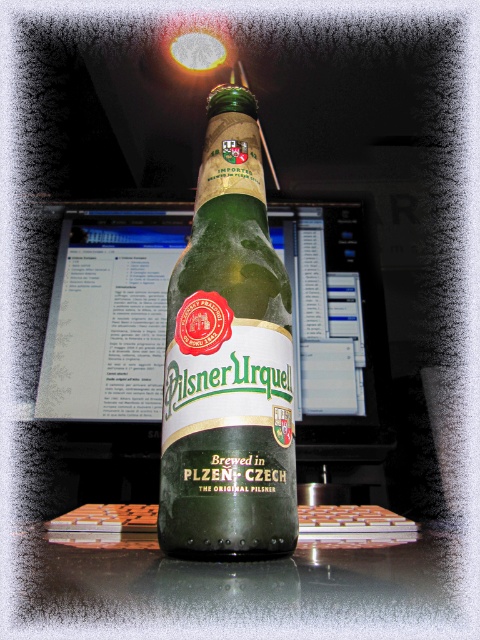
Question: Is green glass bottle at center to the right of matte plastic monitor at center from the viewer's perspective?

Choices:
 (A) yes
 (B) no

Answer: (A)

Question: Considering the relative positions of green glass bottle at center and matte plastic monitor at center in the image provided, where is green glass bottle at center located with respect to matte plastic monitor at center?

Choices:
 (A) below
 (B) above

Answer: (A)

Question: Which point is farther from the camera taking this photo?

Choices:
 (A) (262, 272)
 (B) (309, 365)

Answer: (B)

Question: Is green glass bottle at center closer to the viewer compared to matte plastic monitor at center?

Choices:
 (A) no
 (B) yes

Answer: (B)